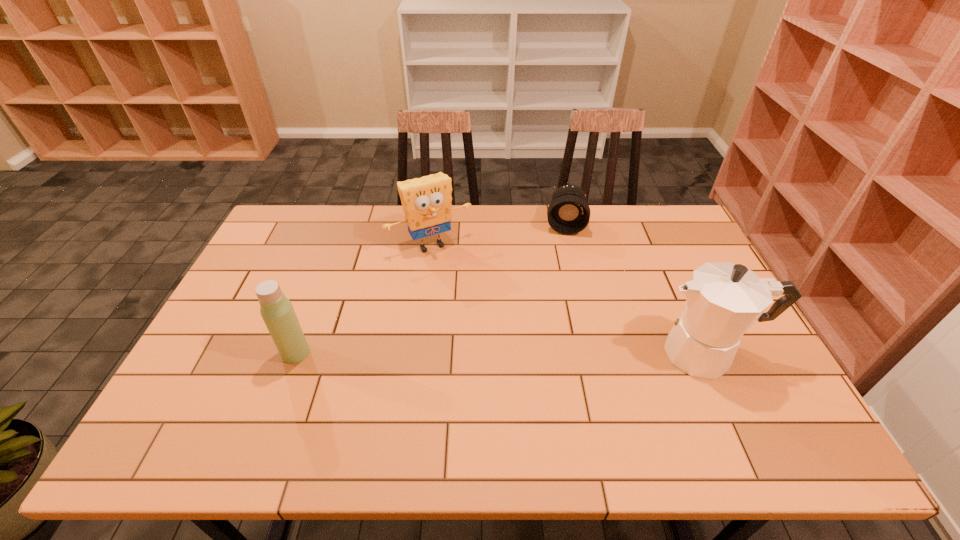
Find the location of `the leftmost object`. the leftmost object is located at coordinates (278, 314).

What are the coordinates of `coffeepot` in the screenshot? It's located at (723, 300).

In order to click on the tallest object in this screenshot , I will do `click(723, 300)`.

Identify the location of the second object from left to right. Image resolution: width=960 pixels, height=540 pixels. (426, 201).

You are a GUI agent. You are given a task and a screenshot of the screen. Output one action in this format:
    pyautogui.click(x=<x>, y=<y>)
    Task: Click on the telephoto lens
    The height and width of the screenshot is (540, 960).
    Given the screenshot: What is the action you would take?
    pyautogui.click(x=568, y=213)

The width and height of the screenshot is (960, 540). Find the location of `the second object from right to left`. the second object from right to left is located at coordinates (568, 213).

This screenshot has width=960, height=540. In order to click on vacant region located on the back of the thermos bottle in this screenshot , I will do `click(328, 268)`.

At what (x,y) coordinates should I click in order to perform the action: click on free space located 0.380m at the spout of the rightmost object. Please return your answer as a coordinate pair (x, y). The width and height of the screenshot is (960, 540). Looking at the image, I should click on (508, 353).

Where is `free location located 0.220m at the spout of the rightmost object`? This screenshot has height=540, width=960. free location located 0.220m at the spout of the rightmost object is located at coordinates (569, 353).

Image resolution: width=960 pixels, height=540 pixels. What are the coordinates of `free region located at the spout of the rightmost object` in the screenshot? It's located at (542, 353).